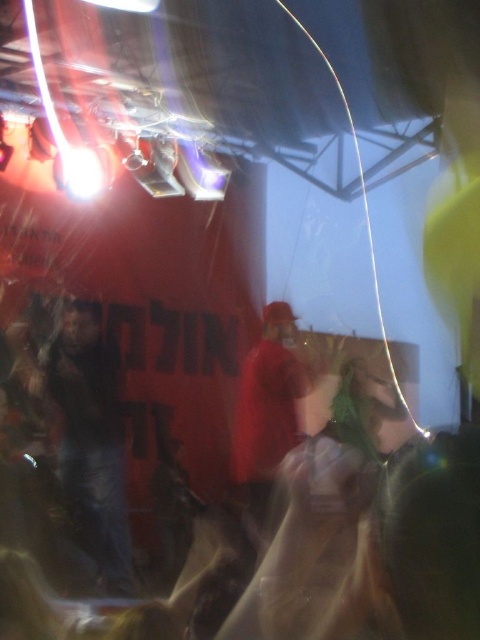
Question: Which point is farther to the camera?

Choices:
 (A) (283, 426)
 (B) (108, 477)

Answer: (A)

Question: Which object is closer to the camera taking this photo?

Choices:
 (A) red fabric cap at center
 (B) dark blue jeans at center

Answer: (B)

Question: Does dark blue jeans at center appear on the left side of red fabric cap at center?

Choices:
 (A) no
 (B) yes

Answer: (B)

Question: Is dark blue jeans at center above red fabric cap at center?

Choices:
 (A) yes
 (B) no

Answer: (B)

Question: In this image, where is dark blue jeans at center located relative to red fabric cap at center?

Choices:
 (A) right
 (B) left

Answer: (B)

Question: Which object appears farthest from the camera in this image?

Choices:
 (A) dark blue jeans at center
 (B) red fabric cap at center

Answer: (B)